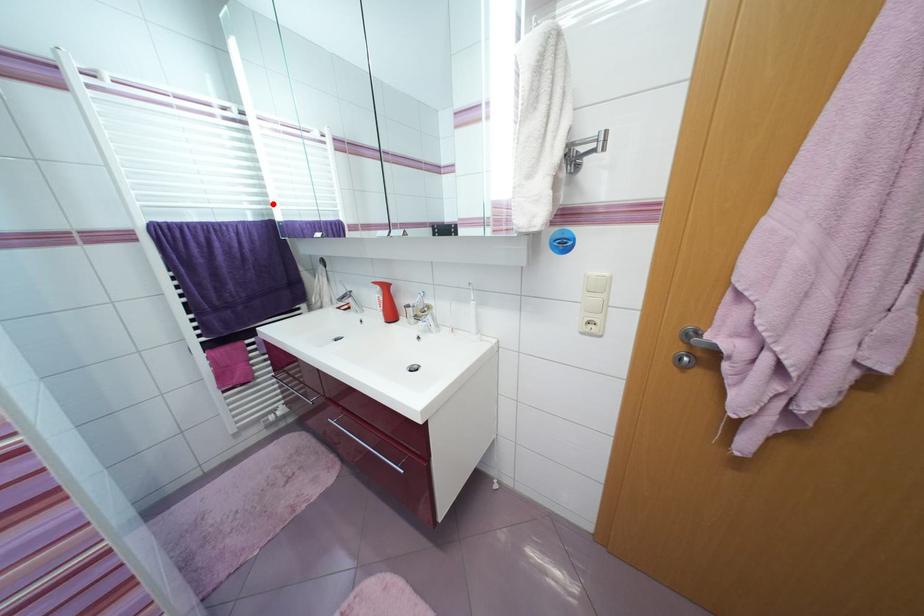
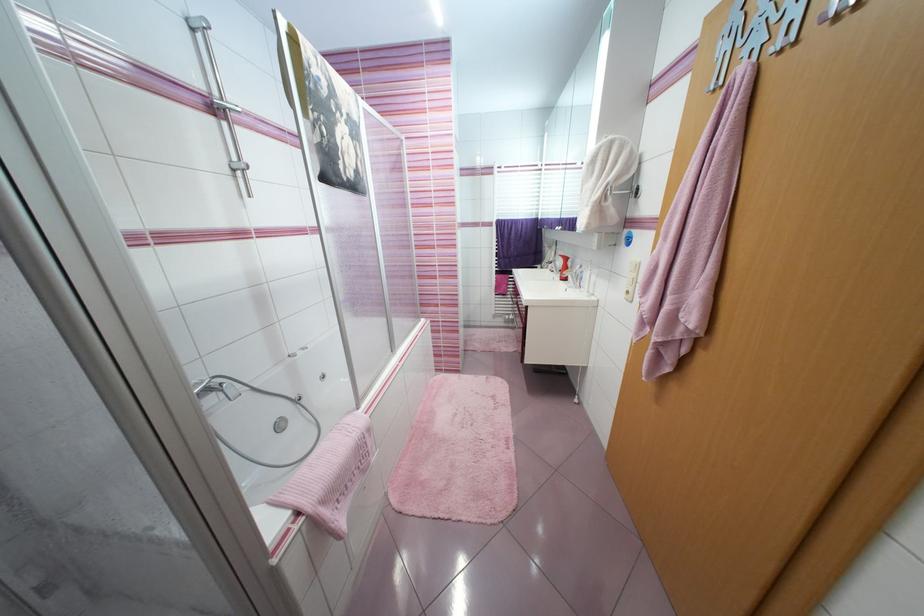
Find the pixel in the second image that matches the highlighted location in the first image.

(543, 211)